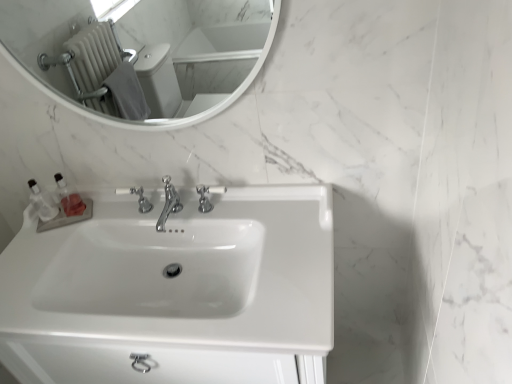
Question: Should I look upward or downward to see polished chrome faucet at center, which appears as the second tap when viewed from the right?

Choices:
 (A) down
 (B) up

Answer: (A)

Question: Should I look upward or downward to see chrome metallic faucet at center, which is the 3th tap in right-to-left order?

Choices:
 (A) up
 (B) down

Answer: (B)

Question: Does clear plastic bottles at left, the 1th toiletry when ordered from right to left, have a larger size compared to polished chrome faucet at center, which appears as the second tap when viewed from the right?

Choices:
 (A) yes
 (B) no

Answer: (B)

Question: Does clear plastic bottles at left, the 1th toiletry when ordered from right to left, come in front of polished chrome faucet at center, acting as the second tap starting from the left?

Choices:
 (A) yes
 (B) no

Answer: (B)

Question: Is clear plastic bottles at left, the 1th toiletry when ordered from right to left, next to polished chrome faucet at center, which appears as the second tap when viewed from the right?

Choices:
 (A) no
 (B) yes

Answer: (A)

Question: Is clear plastic bottles at left, the 1th toiletry when ordered from right to left, at the left side of polished chrome faucet at center, acting as the second tap starting from the left?

Choices:
 (A) no
 (B) yes

Answer: (B)

Question: From a real-world perspective, is clear plastic bottles at left, the 1th toiletry when ordered from right to left, physically above polished chrome faucet at center, which appears as the second tap when viewed from the right?

Choices:
 (A) no
 (B) yes

Answer: (B)

Question: Can you confirm if clear plastic bottles at left, which is the second toiletry from left to right, is thinner than polished chrome faucet at center, acting as the second tap starting from the left?

Choices:
 (A) no
 (B) yes

Answer: (B)

Question: Are polished chrome faucet at center, the 3th tap positioned from the left, and clear plastic bottles at left, which is the second toiletry from left to right, far apart?

Choices:
 (A) yes
 (B) no

Answer: (B)

Question: Considering the relative sizes of polished chrome faucet at center, positioned as the 1th tap in right-to-left order, and clear plastic bottles at left, which is the second toiletry from left to right, in the image provided, is polished chrome faucet at center, positioned as the 1th tap in right-to-left order, taller than clear plastic bottles at left, which is the second toiletry from left to right,?

Choices:
 (A) yes
 (B) no

Answer: (B)

Question: Does polished chrome faucet at center, the 3th tap positioned from the left, have a lesser height compared to clear plastic bottles at left, the 1th toiletry when ordered from right to left?

Choices:
 (A) no
 (B) yes

Answer: (B)

Question: Would you say polished chrome faucet at center, the 3th tap positioned from the left, is outside clear plastic bottles at left, which is the second toiletry from left to right?

Choices:
 (A) yes
 (B) no

Answer: (A)

Question: From a real-world perspective, is polished chrome faucet at center, positioned as the 1th tap in right-to-left order, positioned under clear plastic bottles at left, the 1th toiletry when ordered from right to left, based on gravity?

Choices:
 (A) no
 (B) yes

Answer: (B)

Question: From the image's perspective, is polished chrome faucet at center, the 3th tap positioned from the left, on clear plastic bottles at left, the 1th toiletry when ordered from right to left?

Choices:
 (A) yes
 (B) no

Answer: (B)

Question: Does white glossy mirror at upper center have a smaller size compared to clear plastic bottles at left, which is the second toiletry from left to right?

Choices:
 (A) no
 (B) yes

Answer: (A)